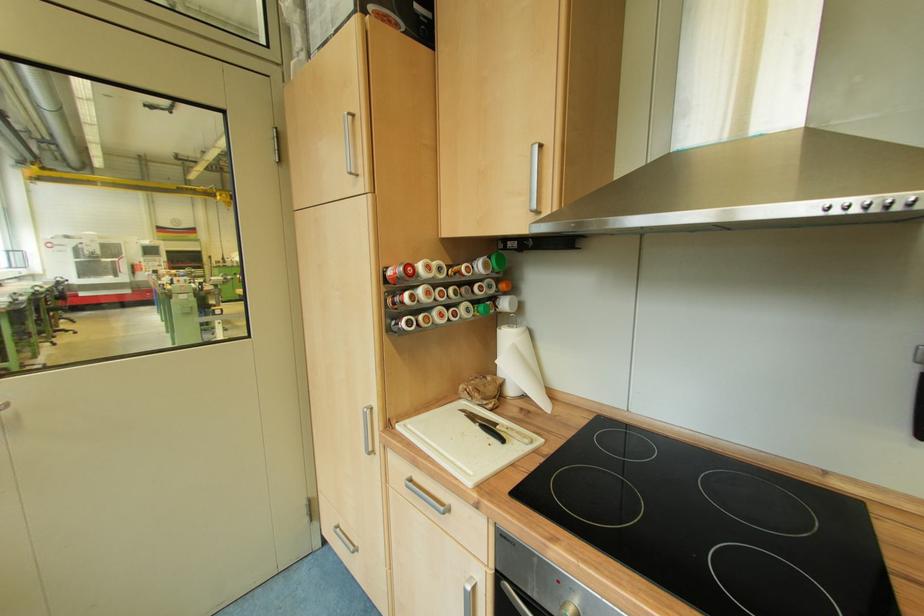
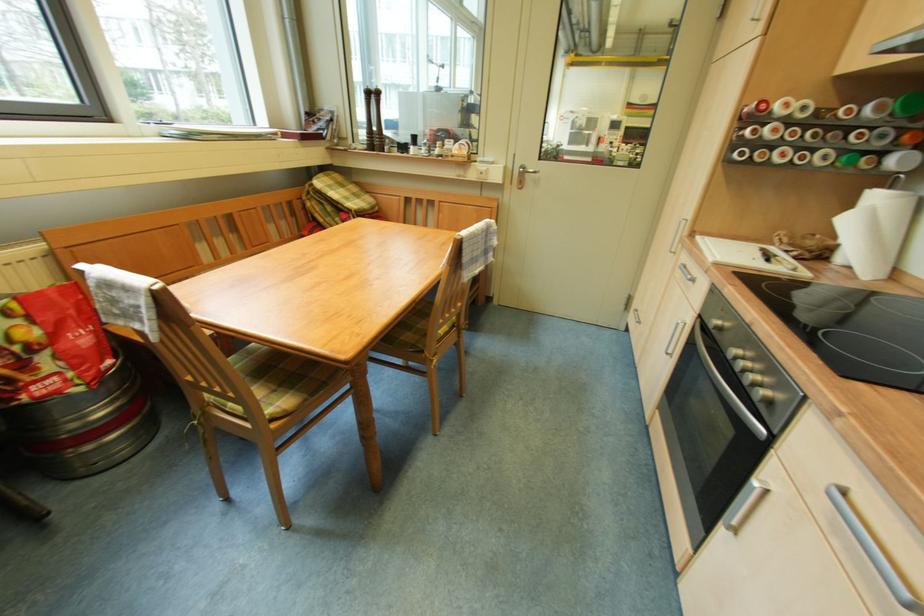
First-person continuous shooting, in which direction is the camera rotating?

The rotation direction of the camera is left-down.